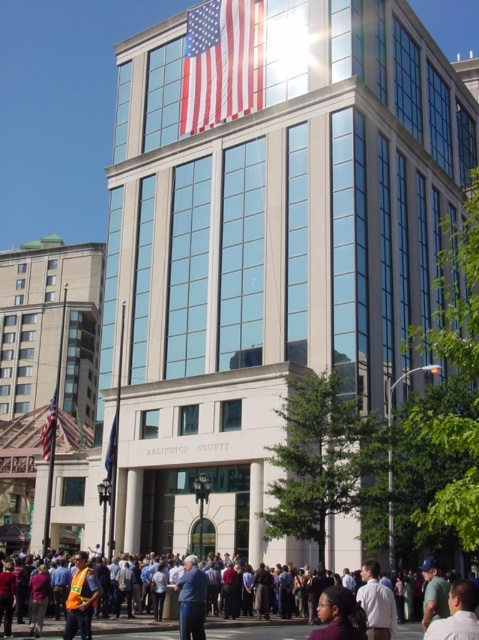
You are standing in front of the building and notice a safety vest. Where exactly is the orange safety vest at lower left located in the image?

The orange safety vest at lower left is located at point (132, 625) in the image.

You are a photographer standing in front of the building and notice two shirts at the center of the crowd. The white shirt at center and the blue fabric shirt at center. Which shirt appears narrower?

The white shirt at center has a lesser width compared to the blue fabric shirt at center, so the white shirt at center appears narrower.